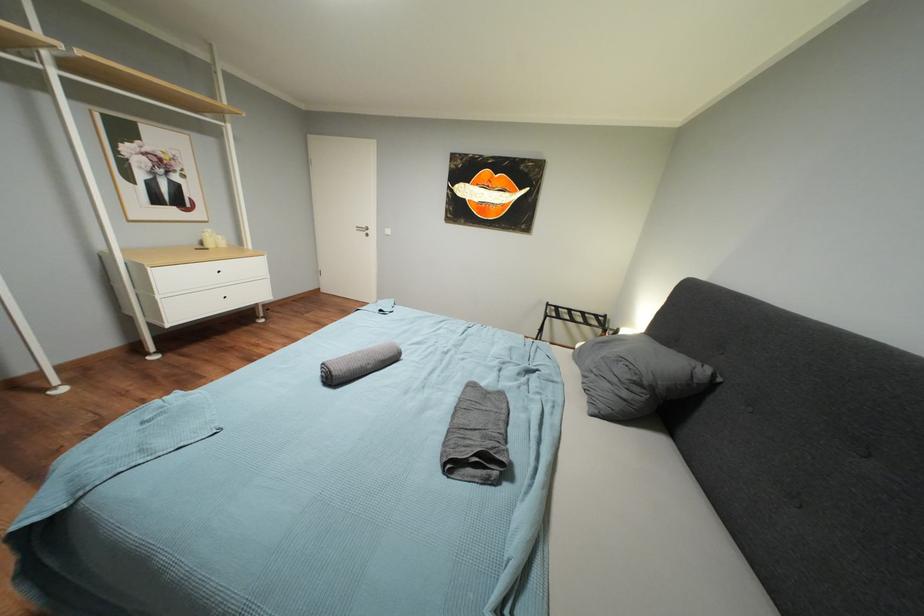
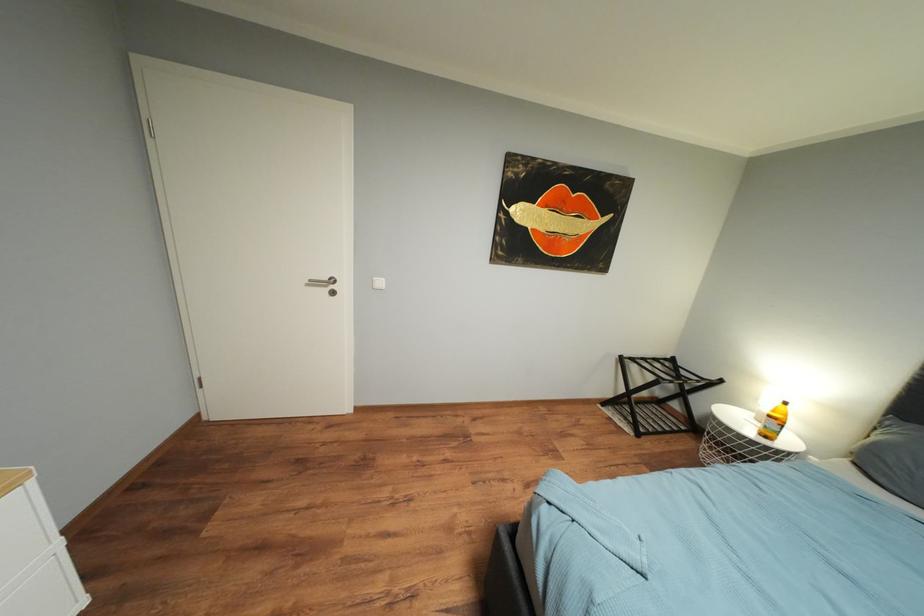
In a continuous first-person perspective shot, in which direction is the camera moving?

The cameraman walked toward left, forward.